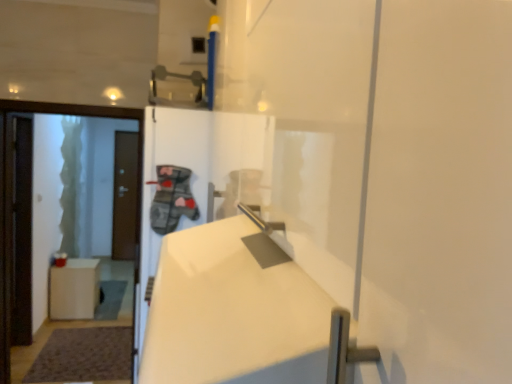
This screenshot has width=512, height=384. What do you see at coordinates (126, 195) in the screenshot?
I see `brown matte door at left, the first door positioned from the left` at bounding box center [126, 195].

In order to click on white glossy door at left, arranged as the second door when viewed from the left in this screenshot , I will do `click(89, 116)`.

What are the coordinates of `brown matte door at left, the first door positioned from the left` in the screenshot? It's located at (126, 195).

Who is taller, brown matte door at left, arranged as the 2th door when viewed from the right, or white glossy door at left, the 2th door positioned from the back?

brown matte door at left, arranged as the 2th door when viewed from the right.

Identify the location of door on the right of brown matte door at left, arranged as the 2th door when viewed from the right. pyautogui.click(x=89, y=116).

From the image's perspective, which is below, brown matte door at left, the first door positioned from the left, or white glossy door at left, marked as the first door in a right-to-left arrangement?

white glossy door at left, marked as the first door in a right-to-left arrangement, is shown below in the image.

Which object is more forward, brown matte door at left, which appears as the 2th door when viewed from the front, or white glossy door at left, the 2th door positioned from the back?

white glossy door at left, the 2th door positioned from the back, is in front.

Is brown matte door at left, which is the first door from back to front, smaller than white matte trash can at lower left?

Yes.

Could you tell me if brown matte door at left, which appears as the 2th door when viewed from the front, is turned towards white matte trash can at lower left?

Yes.

Is brown matte door at left, arranged as the 2th door when viewed from the right, wider or thinner than white matte trash can at lower left?

Considering their sizes, brown matte door at left, arranged as the 2th door when viewed from the right, looks slimmer than white matte trash can at lower left.

Visually, is white matte trash can at lower left positioned to the left or to the right of brown matte door at left, which appears as the 2th door when viewed from the front?

In the image, white matte trash can at lower left appears on the right side of brown matte door at left, which appears as the 2th door when viewed from the front.

Is white matte trash can at lower left further to the viewer compared to brown matte door at left, arranged as the 2th door when viewed from the right?

No, white matte trash can at lower left is in front of brown matte door at left, arranged as the 2th door when viewed from the right.

From the image's perspective, is white matte trash can at lower left below brown matte door at left, the first door positioned from the left?

Correct, white matte trash can at lower left appears lower than brown matte door at left, the first door positioned from the left, in the image.

I want to click on furniture to the right of brown matte door at left, arranged as the 2th door when viewed from the right, so click(x=74, y=289).

In the image, there is a white glossy door at left, marked as the first door in a right-to-left arrangement. Identify the location of door above it (from the image's perspective). The width and height of the screenshot is (512, 384). (126, 195).

From the picture: Which of these two, white glossy door at left, marked as the first door in a right-to-left arrangement, or brown matte door at left, the first door positioned from the left, is smaller?

brown matte door at left, the first door positioned from the left, is smaller.

From a real-world perspective, is white glossy door at left, the 1th door viewed from the front, physically below brown matte door at left, arranged as the 2th door when viewed from the right?

No, from a real-world perspective, white glossy door at left, the 1th door viewed from the front, is not below brown matte door at left, arranged as the 2th door when viewed from the right.

Which is behind, metallic gray door handle at upper center or white glossy door at left, the 2th door positioned from the back?

white glossy door at left, the 2th door positioned from the back.

From a real-world perspective, is metallic gray door handle at upper center under white glossy door at left, marked as the first door in a right-to-left arrangement?

Actually, metallic gray door handle at upper center is physically above white glossy door at left, marked as the first door in a right-to-left arrangement, in the real world.

Considering the positions of objects metallic gray door handle at upper center and white glossy door at left, the 2th door positioned from the back, in the image provided, who is more to the left, metallic gray door handle at upper center or white glossy door at left, the 2th door positioned from the back,?

Positioned to the left is white glossy door at left, the 2th door positioned from the back.

From the image's perspective, does metallic gray door handle at upper center appear higher than white glossy door at left, marked as the first door in a right-to-left arrangement?

→ Yes, from the image's perspective, metallic gray door handle at upper center is above white glossy door at left, marked as the first door in a right-to-left arrangement.

Does point (172, 79) come in front of point (138, 142)?

Yes.

Starting from the metallic gray door handle at upper center, which door is the 2nd one behind? Please provide its 2D coordinates.

[(126, 195)]

From the image's perspective, who appears lower, metallic gray door handle at upper center or brown matte door at left, arranged as the 2th door when viewed from the right?

From the image's view, brown matte door at left, arranged as the 2th door when viewed from the right, is below.

From the image's perspective, is white matte trash can at lower left positioned above or below white glossy door at left, arranged as the second door when viewed from the left?

Clearly, from the image's perspective, white matte trash can at lower left is below white glossy door at left, arranged as the second door when viewed from the left.

Considering the sizes of objects white matte trash can at lower left and white glossy door at left, arranged as the second door when viewed from the left, in the image provided, who is bigger, white matte trash can at lower left or white glossy door at left, arranged as the second door when viewed from the left,?

Bigger between the two is white glossy door at left, arranged as the second door when viewed from the left.

Is there a large distance between white matte trash can at lower left and white glossy door at left, the 2th door positioned from the back?

white matte trash can at lower left is positioned a significant distance from white glossy door at left, the 2th door positioned from the back.

From the image's perspective, count 1st doors upward from the white matte trash can at lower left and point to it. Please provide its 2D coordinates.

[(89, 116)]

This screenshot has height=384, width=512. Identify the location of door on the left of white glossy door at left, arranged as the second door when viewed from the left. (126, 195).

Identify the location of furniture in front of the brown matte door at left, which is the first door from back to front. (74, 289).

Based on their spatial positions, is white glossy door at left, arranged as the second door when viewed from the left, or metallic gray door handle at upper center further from white matte trash can at lower left?

Among the two, metallic gray door handle at upper center is located further to white matte trash can at lower left.

When comparing their distances from white matte trash can at lower left, does brown matte door at left, arranged as the 2th door when viewed from the right, or white glossy door at left, arranged as the second door when viewed from the left, seem closer?

brown matte door at left, arranged as the 2th door when viewed from the right, is positioned closer to the anchor white matte trash can at lower left.

Considering their positions, is metallic gray door handle at upper center positioned further to white matte trash can at lower left than brown matte door at left, the first door positioned from the left?

Among the two, metallic gray door handle at upper center is located further to white matte trash can at lower left.

Consider the image. From the image, which object appears to be nearer to white glossy door at left, the 2th door positioned from the back, white matte trash can at lower left or brown matte door at left, the first door positioned from the left?

white matte trash can at lower left is positioned closer to the anchor white glossy door at left, the 2th door positioned from the back.

Which object lies nearer to the anchor point brown matte door at left, arranged as the 2th door when viewed from the right, metallic gray door handle at upper center or white glossy door at left, arranged as the second door when viewed from the left?

white glossy door at left, arranged as the second door when viewed from the left.

Looking at the image, which one is located closer to metallic gray door handle at upper center, brown matte door at left, which is the first door from back to front, or white matte trash can at lower left?

white matte trash can at lower left is positioned closer to the anchor metallic gray door handle at upper center.

Considering their positions, is white glossy door at left, arranged as the second door when viewed from the left, positioned closer to metallic gray door handle at upper center than brown matte door at left, which is the first door from back to front?

The object closer to metallic gray door handle at upper center is white glossy door at left, arranged as the second door when viewed from the left.

Estimate the real-world distances between objects in this image. Which object is further from white matte trash can at lower left, white glossy door at left, the 2th door positioned from the back, or brown matte door at left, arranged as the 2th door when viewed from the right?

The object further to white matte trash can at lower left is white glossy door at left, the 2th door positioned from the back.

This screenshot has width=512, height=384. What are the coordinates of `furniture between metallic gray door handle at upper center and brown matte door at left, which is the first door from back to front, in the front-back direction` in the screenshot? It's located at (74, 289).

At what (x,y) coordinates should I click in order to perform the action: click on door between metallic gray door handle at upper center and white matte trash can at lower left along the z-axis. Please return your answer as a coordinate pair (x, y). Image resolution: width=512 pixels, height=384 pixels. Looking at the image, I should click on (x=89, y=116).

At what (x,y) coordinates should I click in order to perform the action: click on furniture between white glossy door at left, the 2th door positioned from the back, and brown matte door at left, arranged as the 2th door when viewed from the right, from front to back. Please return your answer as a coordinate pair (x, y). The height and width of the screenshot is (384, 512). Looking at the image, I should click on (74, 289).

Identify the location of door positioned between metallic gray door handle at upper center and brown matte door at left, which is the first door from back to front, from near to far. The width and height of the screenshot is (512, 384). click(x=89, y=116).